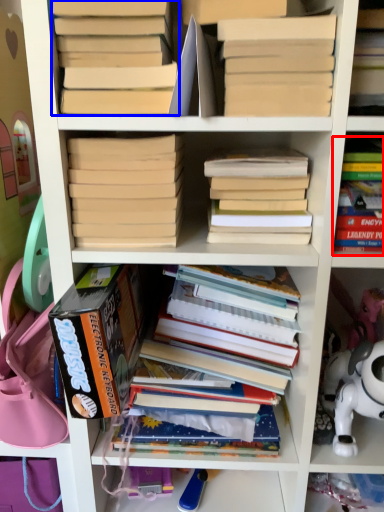
Question: Which of the following is the farthest to the observer, book (highlighted by a red box) or book (highlighted by a blue box)?

Choices:
 (A) book
 (B) book

Answer: (A)